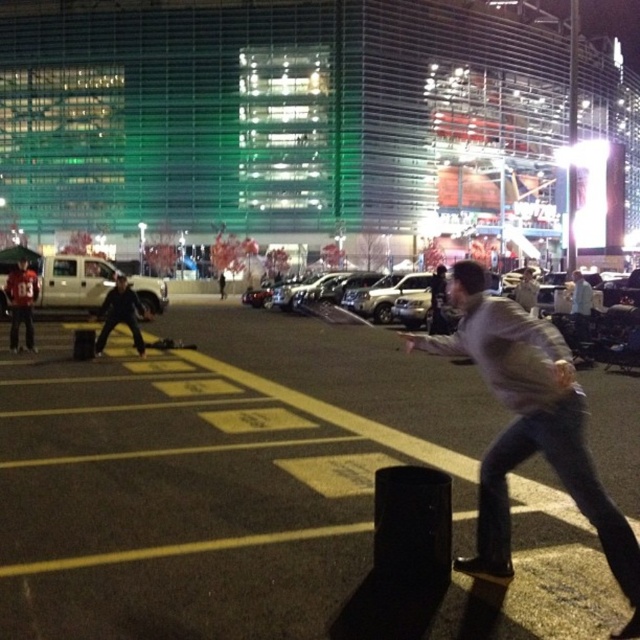
Question: Which of these objects is positioned farthest from the matte black jacket at left?

Choices:
 (A) white matte van at left
 (B) dark gray hoodie at center-left

Answer: (B)

Question: Which object is closer to the camera taking this photo?

Choices:
 (A) dark gray hoodie at center-left
 (B) gray matte skateboard at lower right
 (C) light gray sweater at center
 (D) matte black jacket at left

Answer: (B)

Question: Which of the following is the farthest from the observer?

Choices:
 (A) (12, 349)
 (B) (584, 468)
 (C) (132, 604)

Answer: (A)

Question: Is dark gray hoodie at center-left above matte black jacket at left?

Choices:
 (A) yes
 (B) no

Answer: (B)

Question: Is gray matte skateboard at lower right bigger than light gray sweater at center?

Choices:
 (A) no
 (B) yes

Answer: (A)

Question: Can you confirm if black rubber pole at center is wider than matte black jacket at left?

Choices:
 (A) yes
 (B) no

Answer: (A)